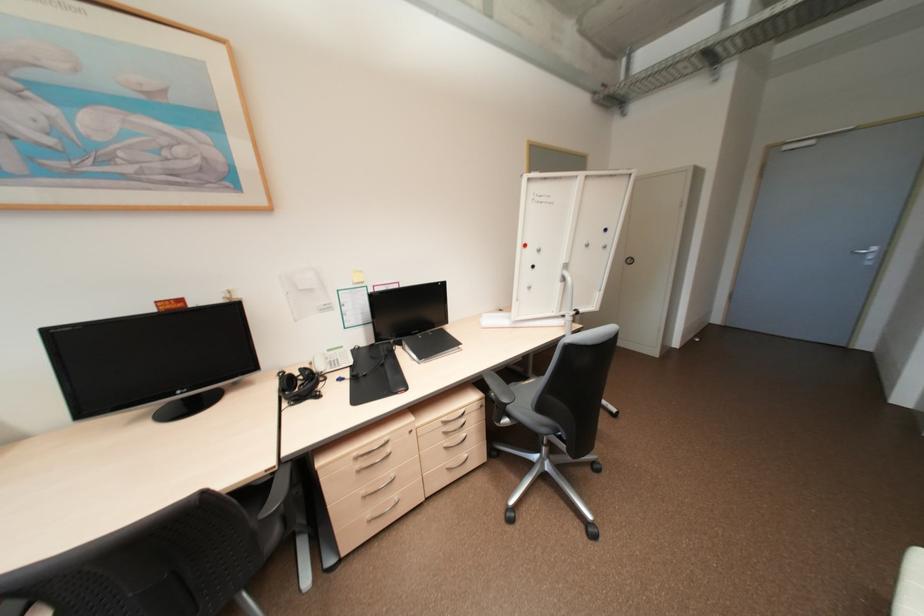
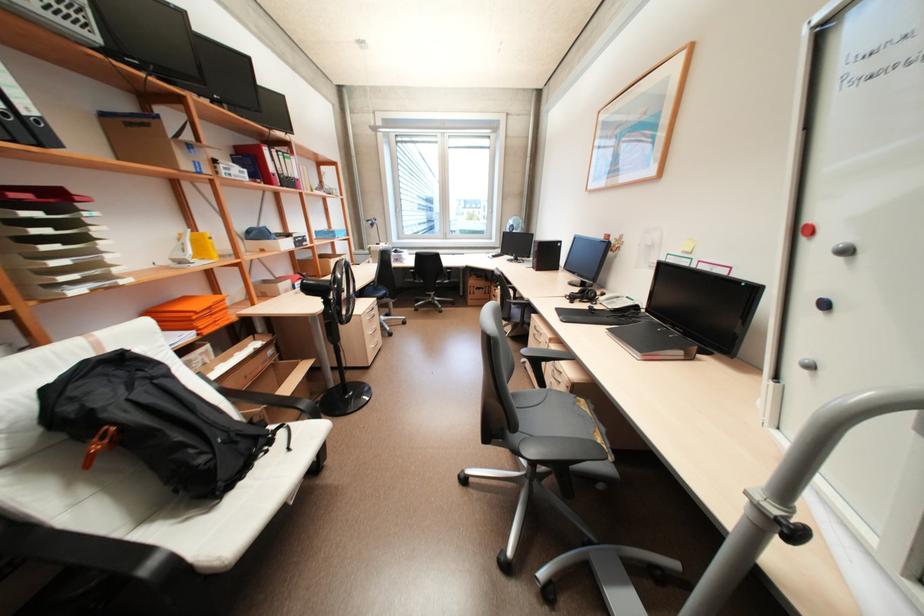
In the second image, find the point that corresponds to (539,265) in the first image.

(830, 304)